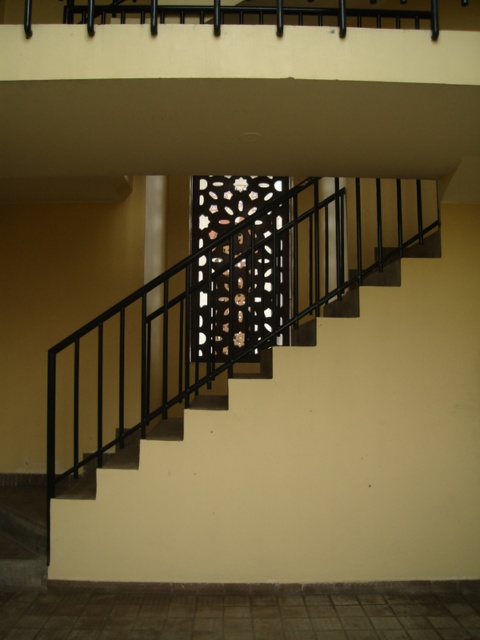
Question: Which is farther from the white glossy pillar at center?

Choices:
 (A) black metal balustrade at upper center
 (B) black metal stairs at center
 (C) black metal/iron pillar at center

Answer: (A)

Question: Does black metal balustrade at upper center appear on the right side of white glossy pillar at center?

Choices:
 (A) yes
 (B) no

Answer: (A)

Question: Estimate the real-world distances between objects in this image. Which object is closer to the black metal stairs at center?

Choices:
 (A) black metal/iron pillar at center
 (B) white glossy pillar at center

Answer: (B)

Question: Does black metal balustrade at upper center have a lesser width compared to black metal/iron pillar at center?

Choices:
 (A) no
 (B) yes

Answer: (A)

Question: Is black metal balustrade at upper center further to camera compared to white glossy pillar at center?

Choices:
 (A) yes
 (B) no

Answer: (B)

Question: Which object appears closest to the camera in this image?

Choices:
 (A) white glossy pillar at center
 (B) black metal/iron pillar at center
 (C) black metal balustrade at upper center

Answer: (C)